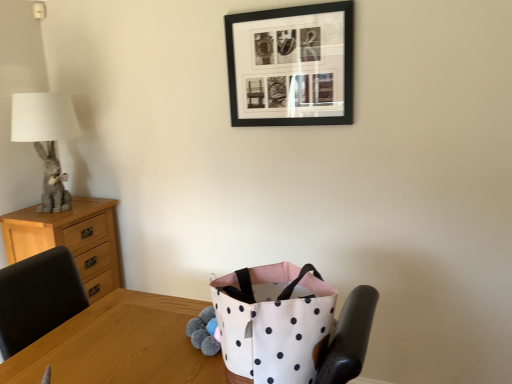
Question: Is gray plush rabbit at left outside of white fabric bag at center?

Choices:
 (A) no
 (B) yes

Answer: (B)

Question: Are gray plush rabbit at left and white fabric bag at center far apart?

Choices:
 (A) no
 (B) yes

Answer: (B)

Question: Is gray plush rabbit at left facing towards white fabric bag at center?

Choices:
 (A) yes
 (B) no

Answer: (B)

Question: From a real-world perspective, is gray plush rabbit at left below white fabric bag at center?

Choices:
 (A) no
 (B) yes

Answer: (A)

Question: Can you confirm if gray plush rabbit at left is shorter than white fabric bag at center?

Choices:
 (A) yes
 (B) no

Answer: (B)

Question: Can you confirm if gray plush rabbit at left is wider than white fabric bag at center?

Choices:
 (A) yes
 (B) no

Answer: (B)

Question: Are white fabric bag at center and gray plush rabbit at left located far from each other?

Choices:
 (A) yes
 (B) no

Answer: (A)

Question: Is white fabric bag at center oriented towards gray plush rabbit at left?

Choices:
 (A) yes
 (B) no

Answer: (B)

Question: From the image's perspective, is white fabric bag at center below gray plush rabbit at left?

Choices:
 (A) no
 (B) yes

Answer: (B)

Question: Is white fabric bag at center outside of gray plush rabbit at left?

Choices:
 (A) yes
 (B) no

Answer: (A)

Question: Is white fabric bag at center to the right of gray plush rabbit at left from the viewer's perspective?

Choices:
 (A) yes
 (B) no

Answer: (A)

Question: From the image's perspective, is white fabric bag at center above gray plush rabbit at left?

Choices:
 (A) no
 (B) yes

Answer: (A)

Question: Can you confirm if light wood chest of drawers at left is positioned to the left of black matte picture frame at upper center?

Choices:
 (A) yes
 (B) no

Answer: (A)